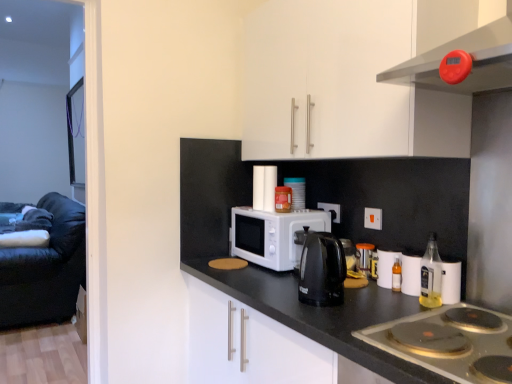
The image size is (512, 384). In order to click on free space to the left of translucent glass bottle at right in this screenshot , I will do `click(386, 302)`.